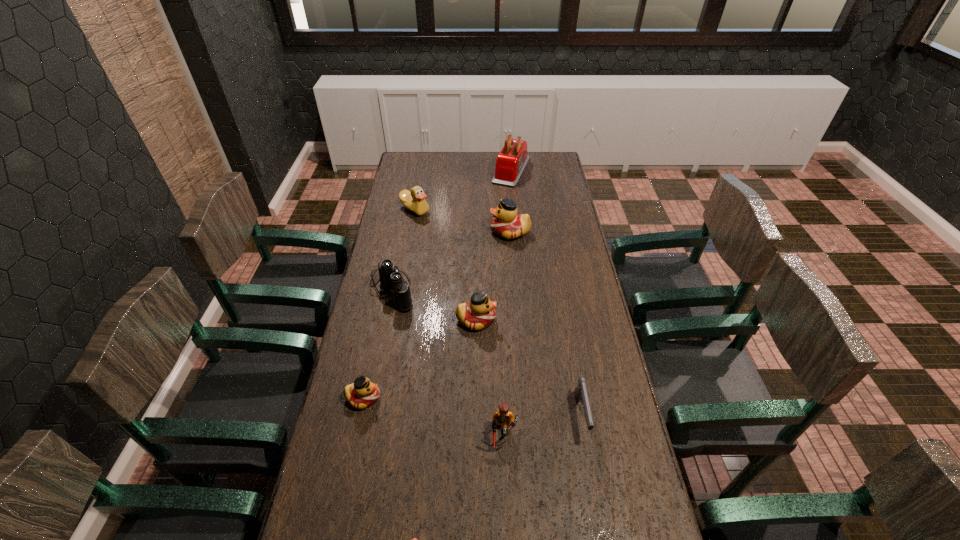
Image resolution: width=960 pixels, height=540 pixels. I want to click on the rightmost object, so click(580, 393).

Find the location of a particular element. The height and width of the screenshot is (540, 960). the leftmost red duck is located at coordinates (362, 393).

Locate an element on the screen. The height and width of the screenshot is (540, 960). the smallest red duck is located at coordinates (362, 393).

At what (x,y) coordinates should I click in order to perform the action: click on vacant region located 0.270m on the front of the red toaster. Please return your answer as a coordinate pair (x, y). This screenshot has height=540, width=960. Looking at the image, I should click on (516, 220).

The width and height of the screenshot is (960, 540). In order to click on free location located on the face of the second farthest duck in this screenshot , I will do `click(430, 232)`.

Locate an element on the screen. free region located 0.220m on the face of the second farthest duck is located at coordinates (440, 232).

This screenshot has width=960, height=540. In order to click on vacant space located 0.330m on the face of the second farthest duck in this screenshot , I will do click(415, 232).

You are a GUI agent. You are given a task and a screenshot of the screen. Output one action in this format:
    pyautogui.click(x=<x>, y=<y>)
    Task: Click on the blank area located 0.230m at the beak of the farther beige duck
    This screenshot has height=540, width=960.
    Given the screenshot: What is the action you would take?
    pyautogui.click(x=407, y=252)

The image size is (960, 540). In order to click on vacant space located 0.330m on the front of the binoculars in this screenshot , I will do `click(371, 394)`.

Image resolution: width=960 pixels, height=540 pixels. What are the coordinates of `free space located 0.250m on the face of the second farthest red duck` in the screenshot? It's located at (565, 320).